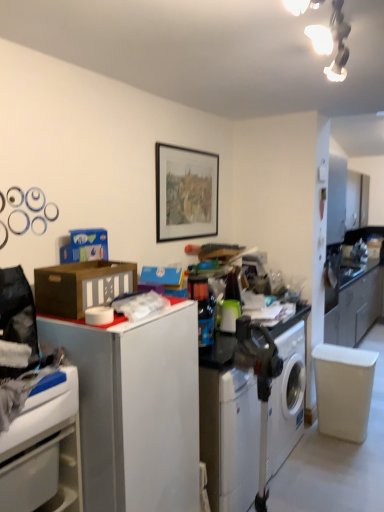
Question: Is white plastic washing machine at lower center facing towards brown cardboard box at left?

Choices:
 (A) yes
 (B) no

Answer: (B)

Question: From a real-world perspective, is white plastic washing machine at lower center physically below brown cardboard box at left?

Choices:
 (A) no
 (B) yes

Answer: (B)

Question: Can you confirm if white plastic washing machine at lower center is thinner than brown cardboard box at left?

Choices:
 (A) no
 (B) yes

Answer: (A)

Question: From the image's perspective, would you say white plastic washing machine at lower center is positioned over brown cardboard box at left?

Choices:
 (A) yes
 (B) no

Answer: (B)

Question: Is white plastic washing machine at lower center not near brown cardboard box at left?

Choices:
 (A) no
 (B) yes

Answer: (B)

Question: Is white plastic washing machine at lower center next to brown cardboard box at left?

Choices:
 (A) no
 (B) yes

Answer: (A)

Question: Is white glossy cabinet at lower left shorter than white matte file cabinet at left?

Choices:
 (A) no
 (B) yes

Answer: (B)

Question: Considering the relative sizes of white glossy cabinet at lower left and white matte file cabinet at left in the image provided, is white glossy cabinet at lower left smaller than white matte file cabinet at left?

Choices:
 (A) yes
 (B) no

Answer: (A)

Question: Is the position of white glossy cabinet at lower left more distant than that of white matte file cabinet at left?

Choices:
 (A) yes
 (B) no

Answer: (B)

Question: Considering the relative sizes of white glossy cabinet at lower left and white matte file cabinet at left in the image provided, is white glossy cabinet at lower left thinner than white matte file cabinet at left?

Choices:
 (A) yes
 (B) no

Answer: (A)

Question: Are white glossy cabinet at lower left and white matte file cabinet at left far apart?

Choices:
 (A) no
 (B) yes

Answer: (A)

Question: Is white glossy cabinet at lower left positioned with its back to white matte file cabinet at left?

Choices:
 (A) yes
 (B) no

Answer: (B)

Question: Is white plastic washing machine at lower center surrounding matte black picture frame at center?

Choices:
 (A) yes
 (B) no

Answer: (B)